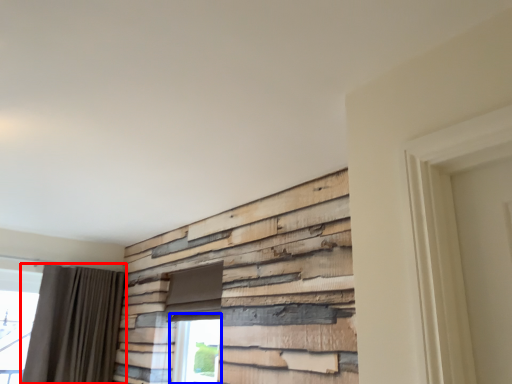
Question: Which object appears farthest to the camera in this image, curtain (highlighted by a red box) or window (highlighted by a blue box)?

Choices:
 (A) curtain
 (B) window

Answer: (A)